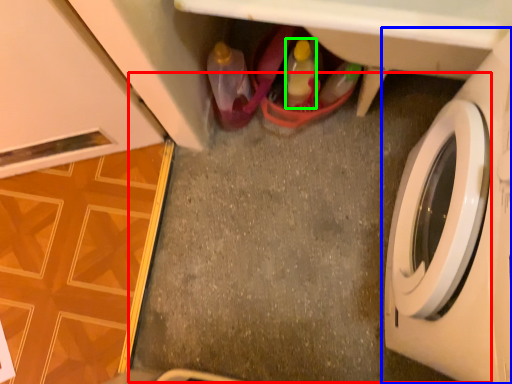
Question: Estimate the real-world distances between objects in this image. Which object is closer to concrete (highlighted by a red box), washing machine (highlighted by a blue box) or bottle (highlighted by a green box)?

Choices:
 (A) washing machine
 (B) bottle

Answer: (B)